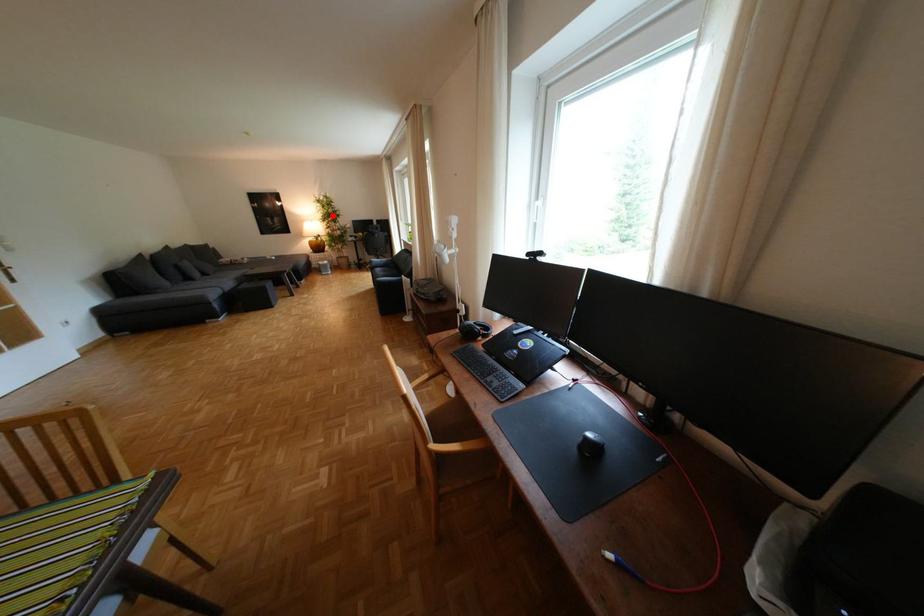
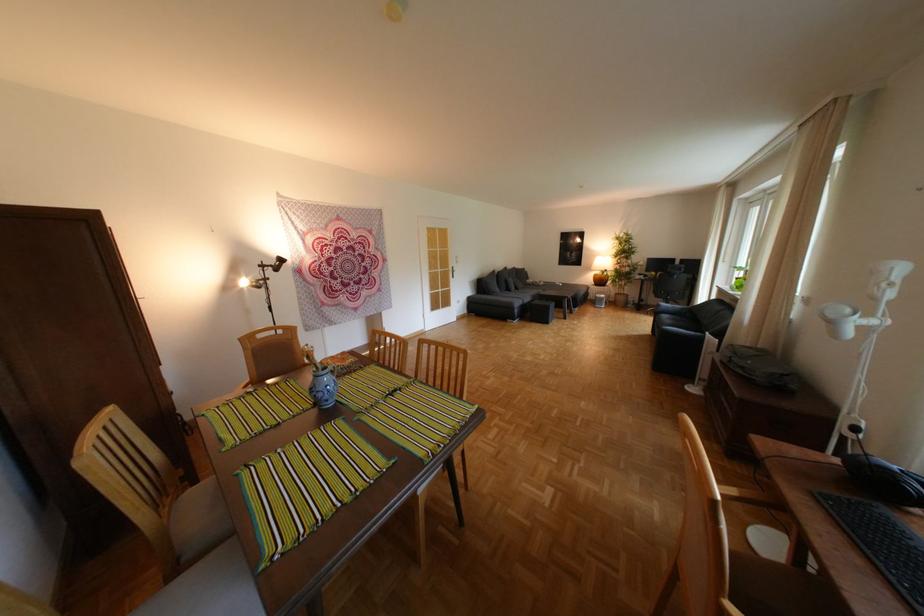
The point at the highlighted location is marked in the first image. Where is the corresponding point in the second image?

(626, 252)